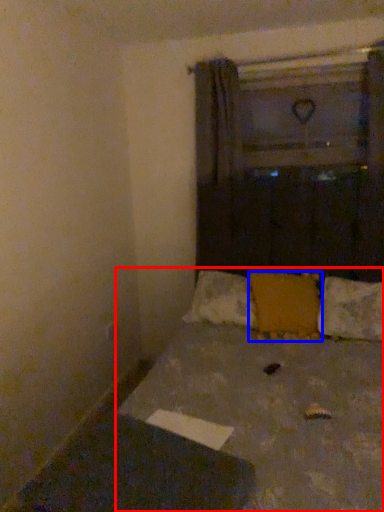
Question: Which object appears closest to the camera in this image, bed (highlighted by a red box) or pillow (highlighted by a blue box)?

Choices:
 (A) bed
 (B) pillow

Answer: (A)